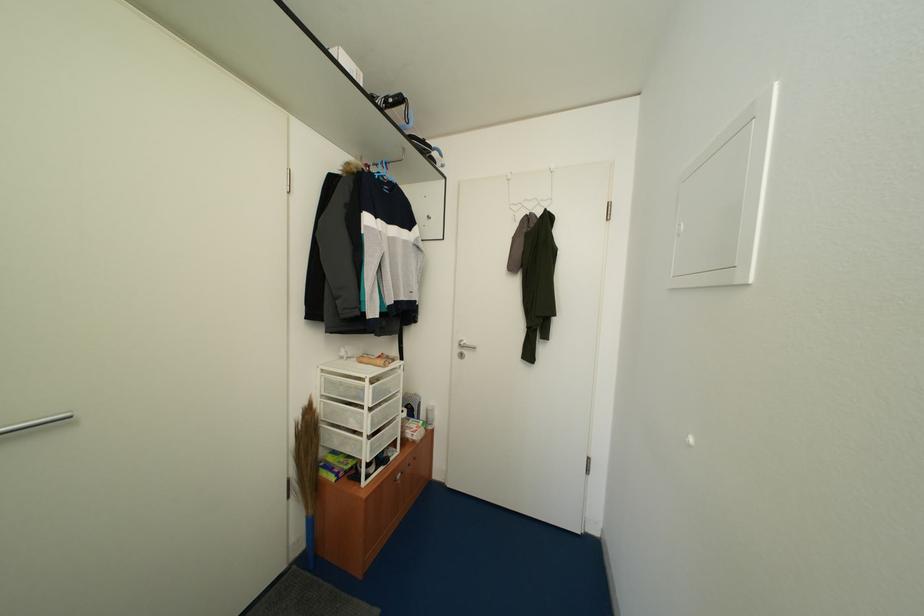
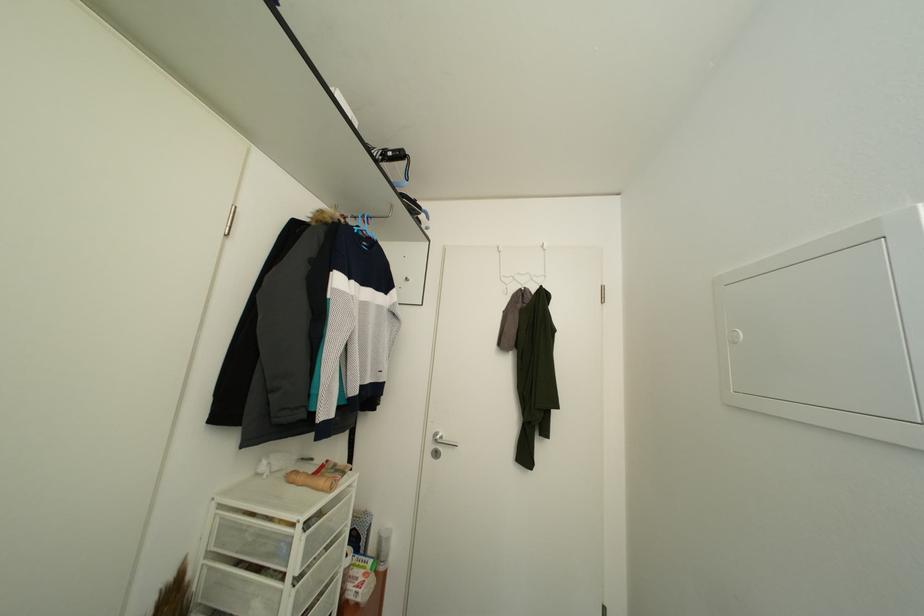
Based on the photo, in a continuous first-person perspective shot, in which direction is the camera moving?

The cameraman moved toward left, forward.